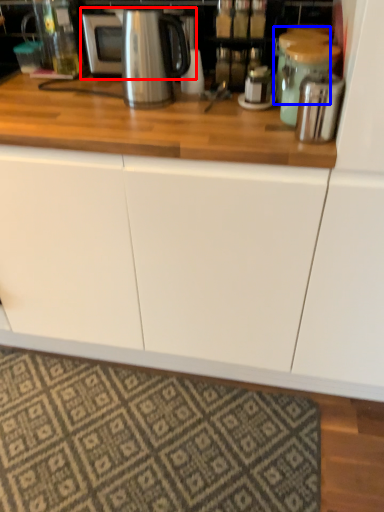
Question: Which object appears closest to the camera in this image, microwave (highlighted by a red box) or appliance (highlighted by a blue box)?

Choices:
 (A) microwave
 (B) appliance

Answer: (B)